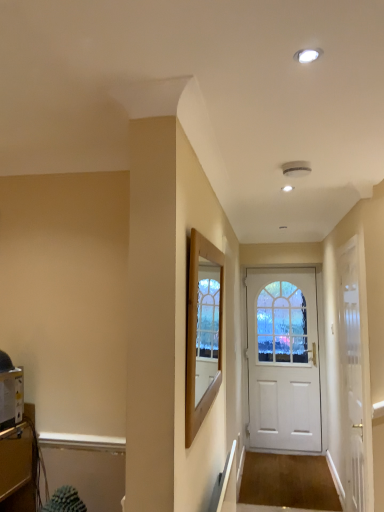
Question: Is wooden frame at center outside of white glossy door at center, which is the 2th door from back to front?

Choices:
 (A) yes
 (B) no

Answer: (A)

Question: From a real-world perspective, is wooden frame at center located beneath white glossy door at center, acting as the 1th door starting from the front?

Choices:
 (A) no
 (B) yes

Answer: (A)

Question: Is wooden frame at center at the right side of white glossy door at center, which is the 2th door from back to front?

Choices:
 (A) yes
 (B) no

Answer: (B)

Question: Would you say white glossy door at center, acting as the 1th door starting from the front, is part of wooden frame at center's contents?

Choices:
 (A) no
 (B) yes

Answer: (A)

Question: Is the position of wooden frame at center less distant than that of white glossy door at center, which is the 2th door from back to front?

Choices:
 (A) yes
 (B) no

Answer: (A)

Question: In the image, is white matte door at center, marked as the first door in a back-to-front arrangement, positioned in front of or behind metallic silver toaster at lower left?

Choices:
 (A) front
 (B) behind

Answer: (B)

Question: From a real-world perspective, is white matte door at center, marked as the first door in a back-to-front arrangement, physically located above or below metallic silver toaster at lower left?

Choices:
 (A) below
 (B) above

Answer: (A)

Question: From the image's perspective, is white matte door at center, marked as the first door in a back-to-front arrangement, located above or below metallic silver toaster at lower left?

Choices:
 (A) below
 (B) above

Answer: (A)

Question: Based on their positions, is white matte door at center, marked as the first door in a back-to-front arrangement, located to the left or right of metallic silver toaster at lower left?

Choices:
 (A) left
 (B) right

Answer: (B)

Question: Would you say wooden frame at center is inside or outside white glossy door at center, which is the 2th door from back to front?

Choices:
 (A) outside
 (B) inside

Answer: (A)

Question: From the image's perspective, is wooden frame at center above or below white glossy door at center, acting as the 1th door starting from the front?

Choices:
 (A) below
 (B) above

Answer: (B)

Question: Is wooden frame at center to the left or to the right of white glossy door at center, acting as the 1th door starting from the front, in the image?

Choices:
 (A) right
 (B) left

Answer: (B)

Question: Considering the positions of wooden frame at center and white glossy door at center, which is the 2th door from back to front, in the image, is wooden frame at center bigger or smaller than white glossy door at center, which is the 2th door from back to front,?

Choices:
 (A) big
 (B) small

Answer: (B)

Question: Is wooden frame at center spatially inside white matte door at center, the second door from the front, or outside of it?

Choices:
 (A) outside
 (B) inside

Answer: (A)

Question: Does point (213, 392) appear closer or farther from the camera than point (291, 310)?

Choices:
 (A) farther
 (B) closer

Answer: (B)